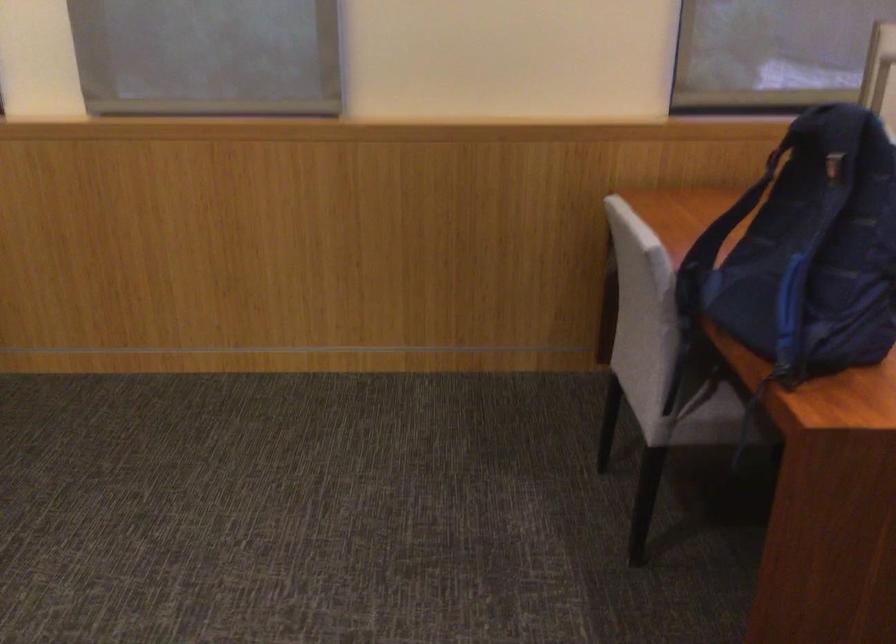
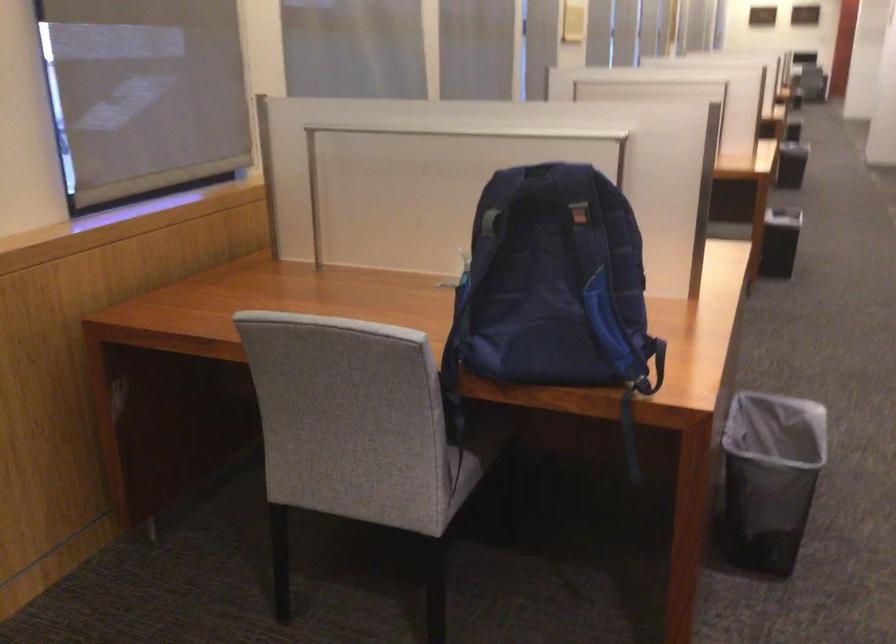
In the second image, find the point that corresponds to point (814, 131) in the first image.

(538, 184)